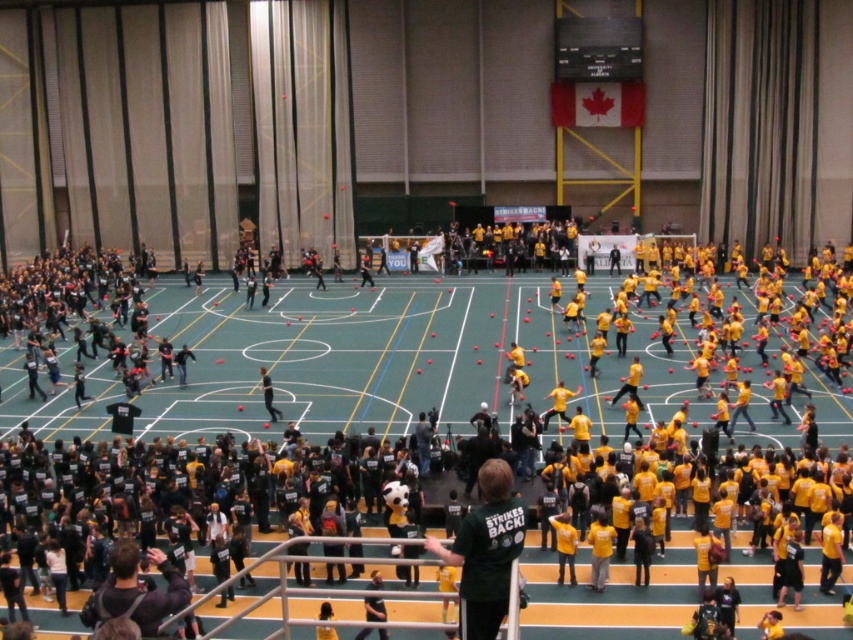
Where is `green jersey at center`? Image resolution: width=853 pixels, height=640 pixels. green jersey at center is located at coordinates (485, 552).

Is green jersey at center shorter than yellow matte shirt at center?

No, green jersey at center is not shorter than yellow matte shirt at center.

Who is more distant from viewer, (x=498, y=582) or (x=550, y=397)?

Positioned behind is point (x=550, y=397).

The width and height of the screenshot is (853, 640). Identify the location of green jersey at center. [x=485, y=552].

Looking at this image, can you confirm if green jersey at center is positioned to the right of yellow jersey at center?

Indeed, green jersey at center is positioned on the right side of yellow jersey at center.

What do you see at coordinates (485, 552) in the screenshot? I see `green jersey at center` at bounding box center [485, 552].

Measure the distance between green jersey at center and camera.

green jersey at center and camera are 15.04 meters apart from each other.

Locate an element on the screen. green jersey at center is located at coordinates (485, 552).

Which is more to the left, yellow matte shirt at center or yellow jersey at center?

yellow jersey at center

Does yellow matte shirt at center have a larger size compared to yellow jersey at center?

Indeed, yellow matte shirt at center has a larger size compared to yellow jersey at center.

Who is more distant from viewer, (560, 381) or (265, 408)?

The point (560, 381) is behind.

What are the coordinates of `yellow matte shirt at center` in the screenshot? It's located at (556, 403).